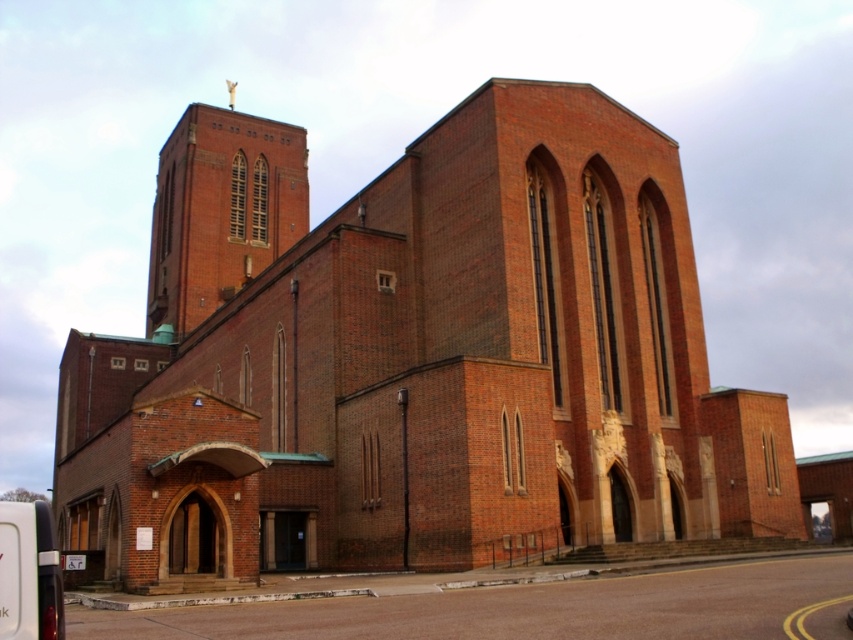
Who is more forward, [582,372] or [283,179]?

Positioned in front is point [582,372].

Who is positioned more to the left, red brick church at center or brick tower at upper center?

brick tower at upper center is more to the left.

Is point (300, 477) positioned before point (158, 234)?

Yes, point (300, 477) is closer to viewer.

Identify the location of red brick church at center. This screenshot has height=640, width=853. (415, 358).